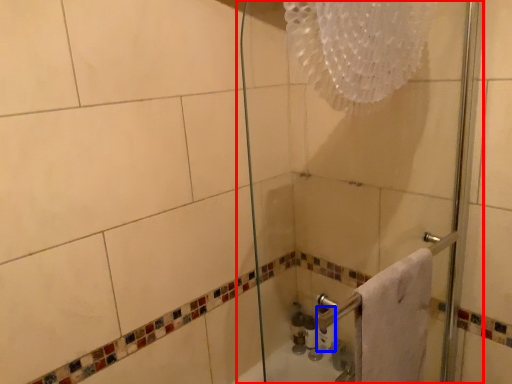
Question: Which object is closer to the camera taking this photo, shower door (highlighted by a red box) or toilet paper (highlighted by a blue box)?

Choices:
 (A) shower door
 (B) toilet paper

Answer: (A)